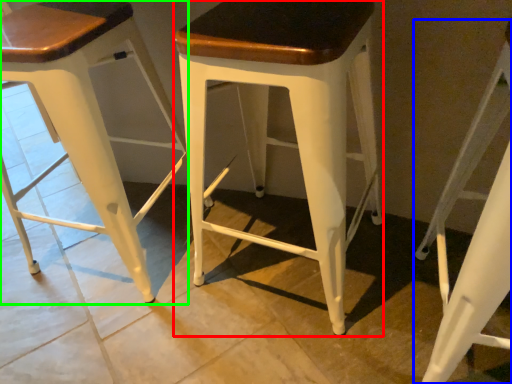
Question: Considering the real-world distances, which object is farthest from stool (highlighted by a red box)? stool (highlighted by a blue box) or stool (highlighted by a green box)?

Choices:
 (A) stool
 (B) stool

Answer: (B)